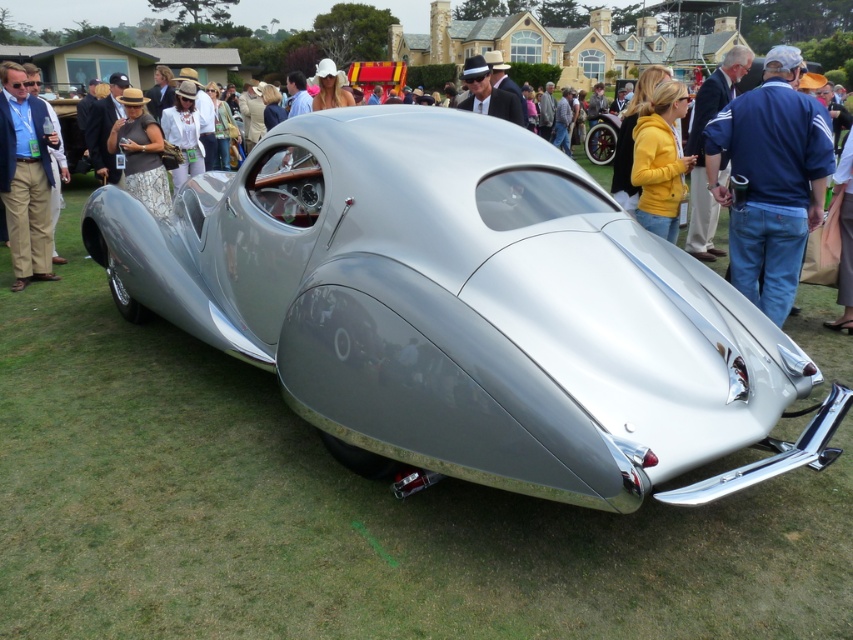
Question: Which point appears closest to the camera in this image?

Choices:
 (A) (732, 125)
 (B) (41, 129)
 (C) (279, 273)

Answer: (C)

Question: Which is nearer to the polished silver car at center?

Choices:
 (A) blue denim jeans at right
 (B) brushed metal jacket at left

Answer: (A)

Question: Can you confirm if polished silver car at center is smaller than blue denim jeans at right?

Choices:
 (A) no
 (B) yes

Answer: (A)

Question: Does polished silver car at center have a greater width compared to blue denim jeans at right?

Choices:
 (A) yes
 (B) no

Answer: (A)

Question: Is polished silver car at center positioned before blue denim jeans at right?

Choices:
 (A) no
 (B) yes

Answer: (B)

Question: Which object is positioned farthest from the blue denim jeans at right?

Choices:
 (A) polished silver car at center
 (B) brushed metal jacket at left

Answer: (B)